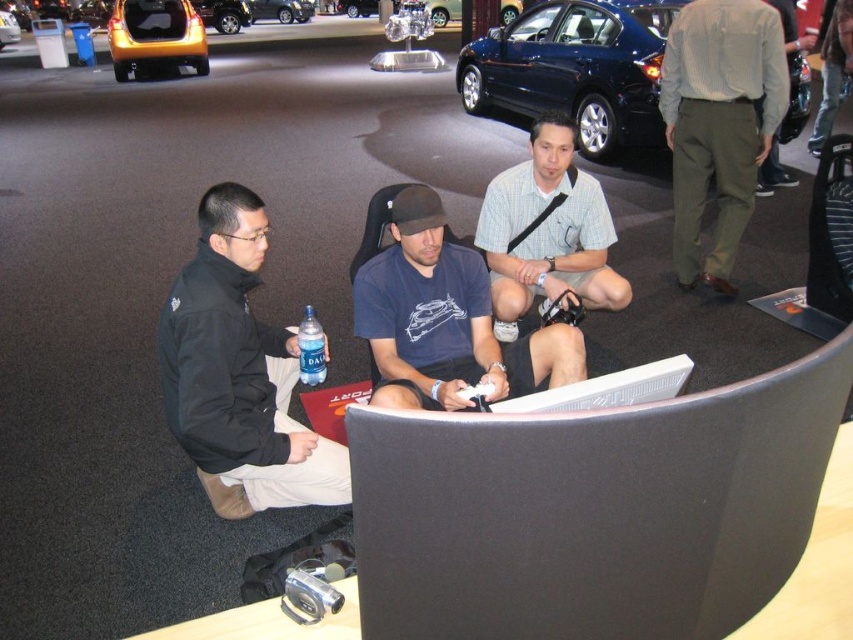
Is the position of shiny blue sedan at center more distant than that of gray striped shirt at center?

Yes, shiny blue sedan at center is behind gray striped shirt at center.

Is point (645, 88) behind point (537, 266)?

Yes, it is behind point (537, 266).

Does point (633, 77) come behind point (485, 193)?

Yes, point (633, 77) is farther from viewer.

At what (x,y) coordinates should I click in order to perform the action: click on shiny blue sedan at center. Please return your answer as a coordinate pair (x, y). This screenshot has height=640, width=853. Looking at the image, I should click on (x=576, y=68).

Between point (421, 360) and point (231, 12), which one is positioned in front?

Point (421, 360) is in front.

Can you confirm if dark blue t-shirt at center is positioned below shiny metallic car at upper left?

Yes, dark blue t-shirt at center is below shiny metallic car at upper left.

Which is in front, point (579, 356) or point (224, 32)?

Point (579, 356)

The image size is (853, 640). Identify the location of dark blue t-shirt at center. (445, 320).

Does point (225, 19) lie in front of point (283, 3)?

Yes, point (225, 19) is in front of point (283, 3).

Can you confirm if shiny metallic car at upper left is thinner than gold metallic hatchback at center?

Yes, shiny metallic car at upper left is thinner than gold metallic hatchback at center.

The image size is (853, 640). I want to click on shiny metallic car at upper left, so click(222, 13).